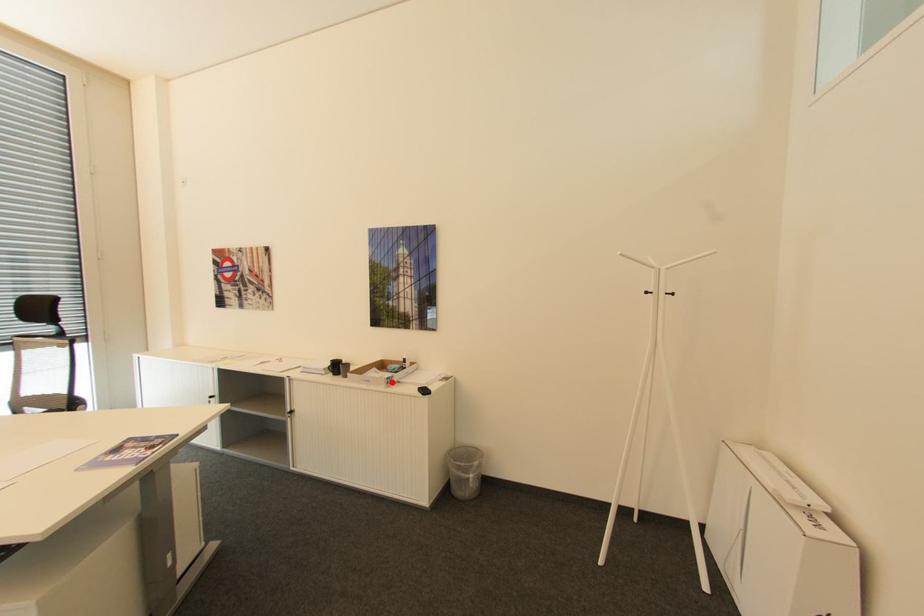
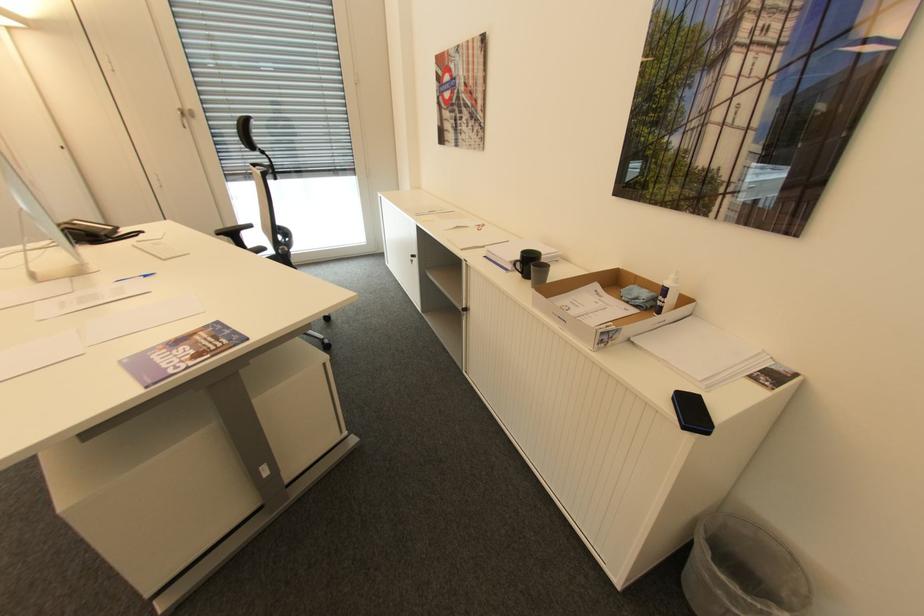
Find the pixel in the second image that matches the highlighted location in the first image.

(606, 342)